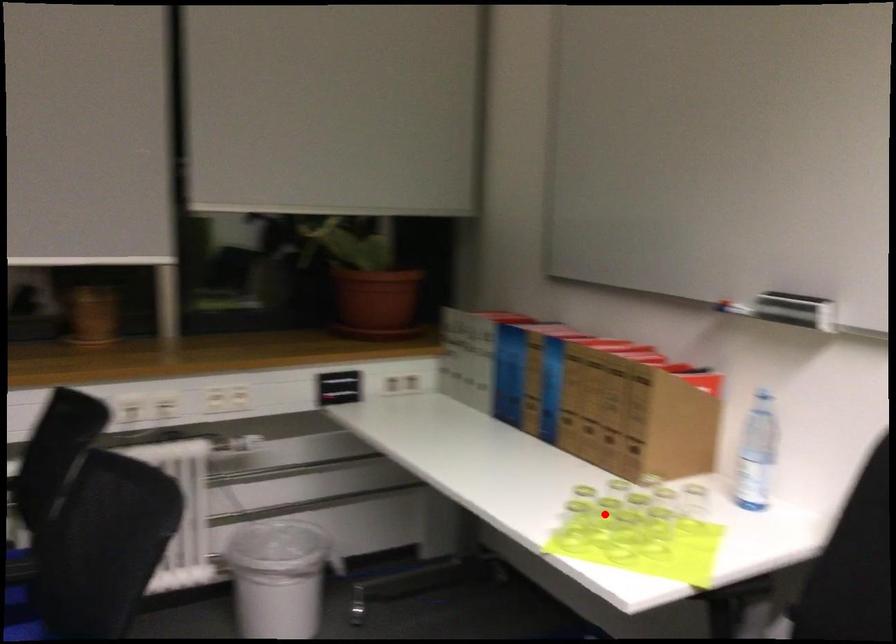
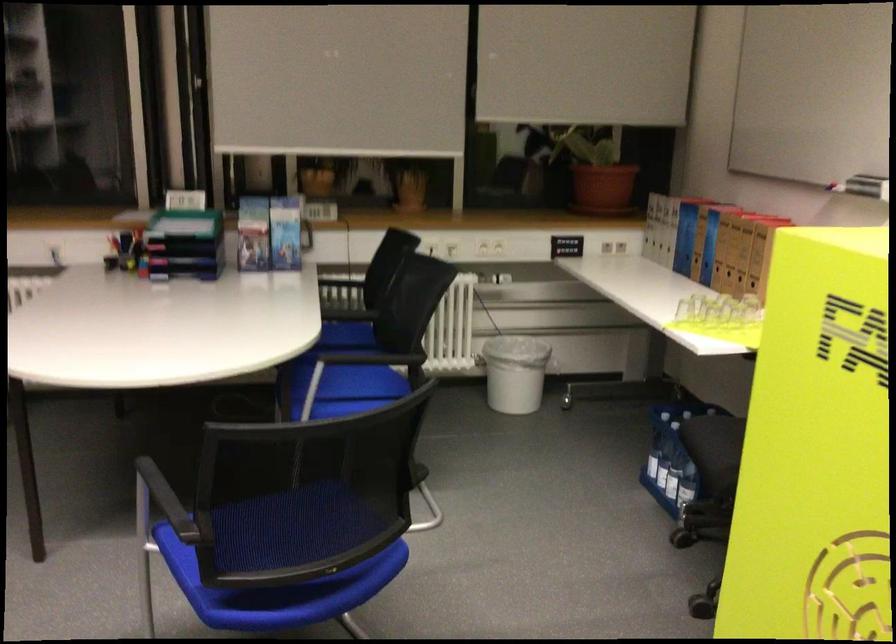
Question: I am providing you with two images of the same scene from different viewpoints. In image1, a red point is highlighted. Considering the same 3D point in image2, which of the following is correct?

Choices:
 (A) It is closer
 (B) It is farther

Answer: (B)